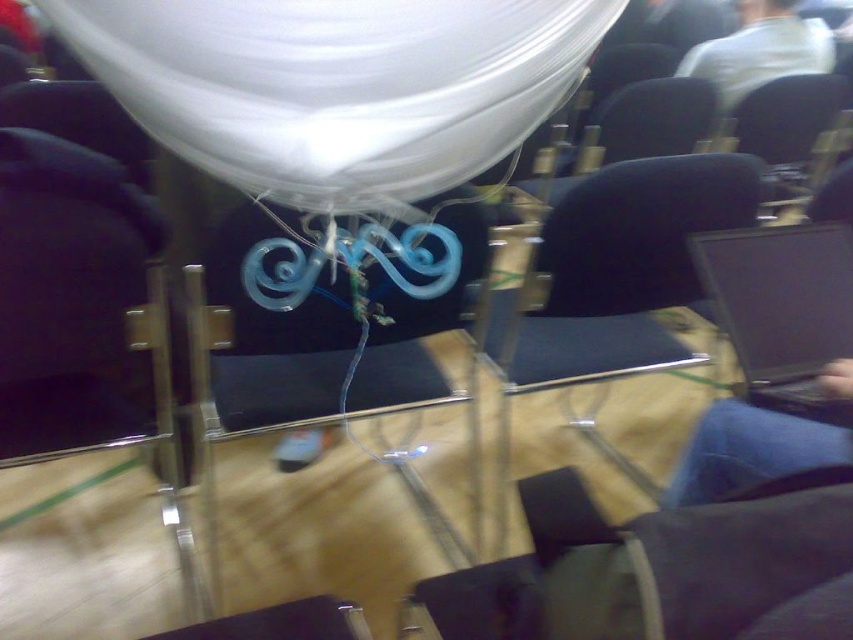
Question: Does white glossy balloon at upper center appear under black fabric chair at upper right?

Choices:
 (A) no
 (B) yes

Answer: (B)

Question: Which object is positioned farthest from the white glossy balloon at upper center?

Choices:
 (A) black fabric armchair at left
 (B) white cotton shirt at upper right
 (C) black fabric chair at upper right

Answer: (B)

Question: Does black fabric armchair at left have a smaller size compared to white cotton shirt at upper right?

Choices:
 (A) yes
 (B) no

Answer: (A)

Question: Does white glossy balloon at upper center appear over black fabric armchair at left?

Choices:
 (A) no
 (B) yes

Answer: (B)

Question: Considering the real-world distances, which object is farthest from the black fabric armchair at left?

Choices:
 (A) white glossy balloon at upper center
 (B) black glossy laptop at center

Answer: (B)

Question: Among these objects, which one is nearest to the camera?

Choices:
 (A) transparent plastic armchair at center
 (B) black glossy laptop at center

Answer: (A)